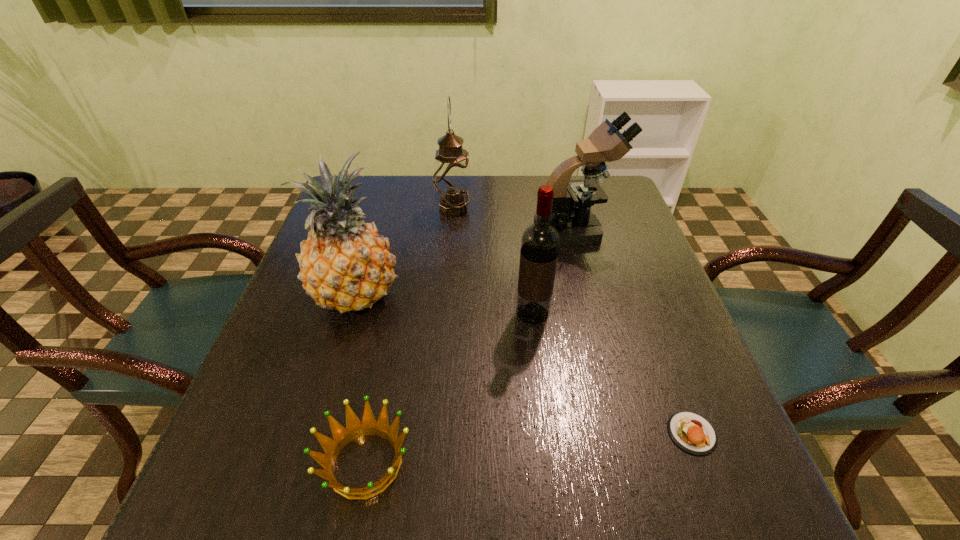
Where is `oil lamp`? oil lamp is located at coordinates (451, 178).

Locate an element on the screen. pineapple is located at coordinates (345, 264).

I want to click on wine bottle, so click(540, 242).

Identify the location of microscope. Image resolution: width=960 pixels, height=540 pixels. (577, 225).

Where is `the second shortest object`? The image size is (960, 540). the second shortest object is located at coordinates (355, 428).

The image size is (960, 540). In order to click on patty (food) in this screenshot , I will do (x=691, y=432).

What are the coordinates of `free space located 0.370m on the front of the oil lamp` in the screenshot? It's located at (444, 318).

Identify the location of free location located 0.230m on the front of the pineapple. (316, 430).

This screenshot has height=540, width=960. Find the location of `vacant space located 0.090m on the front of the wine bottle`. vacant space located 0.090m on the front of the wine bottle is located at coordinates (539, 360).

The width and height of the screenshot is (960, 540). Find the location of `free space located on the back of the microscope`. free space located on the back of the microscope is located at coordinates (562, 182).